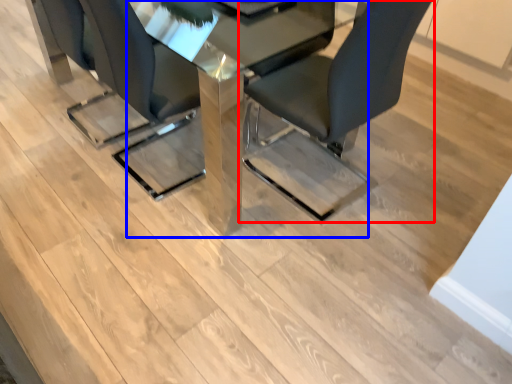
Question: Which point is further to the camera, chair (highlighted by a red box) or table (highlighted by a blue box)?

Choices:
 (A) chair
 (B) table

Answer: (B)